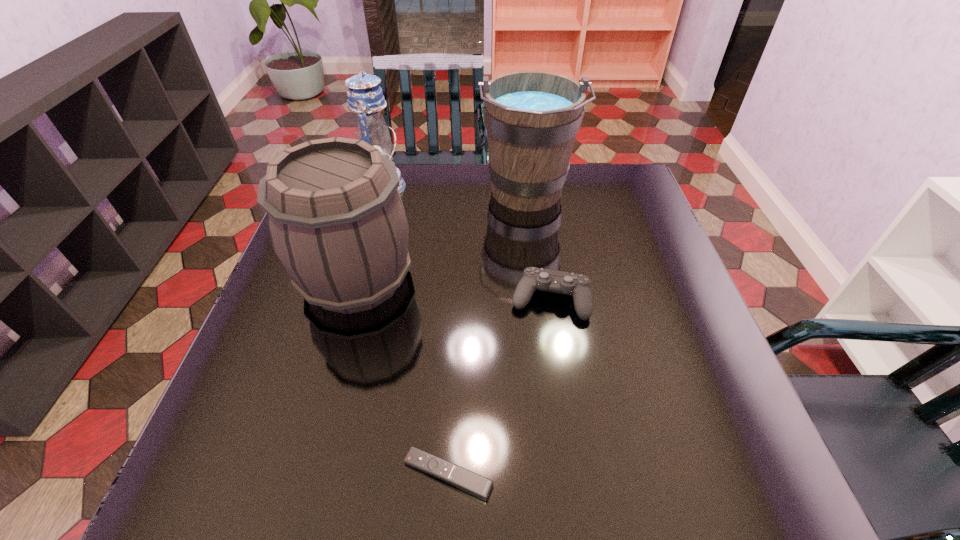
I want to click on free space between the nearest object and the control, so click(499, 387).

This screenshot has height=540, width=960. I want to click on the closest object relative to the lantern, so [x=336, y=220].

Point out which object is positioned as the third nearest to the right wine bucket. Please provide its 2D coordinates. Your answer should be formatted as a tuple, i.e. [(x, y)], where the tuple contains the x and y coordinates of a point satisfying the conditions above.

[(365, 97)]

You are a GUI agent. You are given a task and a screenshot of the screen. Output one action in this format:
    pyautogui.click(x=<x>, y=<y>)
    Task: Click on the free region that satisfies the following two spatial constraints: 1. on the back side of the nearest object; 2. on the left side of the fourth tallest object
    
    Given the screenshot: What is the action you would take?
    pyautogui.click(x=457, y=300)

At what (x,y) coordinates should I click in order to perform the action: click on free space that satisfies the following two spatial constraints: 1. on the front-facing side of the control; 2. on the left side of the lantern. Please return your answer as a coordinate pair (x, y). The height and width of the screenshot is (540, 960). Looking at the image, I should click on (350, 300).

Locate an element on the screen. The height and width of the screenshot is (540, 960). free space that satisfies the following two spatial constraints: 1. on the front-facing side of the lantern; 2. on the right side of the shortest object is located at coordinates (302, 474).

You are a GUI agent. You are given a task and a screenshot of the screen. Output one action in this format:
    pyautogui.click(x=<x>, y=<y>)
    Task: Click on the free location that satisfies the following two spatial constraints: 1. with a handle on the side of the control; 2. on the left side of the farther wine bucket
    This screenshot has height=540, width=960.
    Given the screenshot: What is the action you would take?
    pyautogui.click(x=540, y=300)